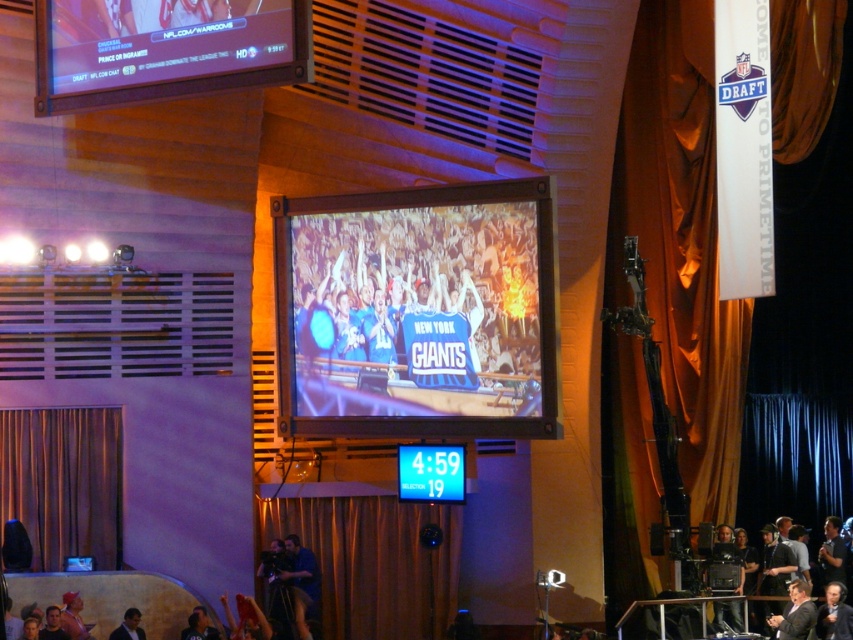
You are a photographer at the event and want to capture both the dark gray suit at lower right and the dark gray suit at lower center in a single frame. Which suit should you focus on to ensure both are in the photo?

You should focus on the dark gray suit at lower center because it is smaller in size than the dark gray suit at lower right, allowing both to fit within the frame.